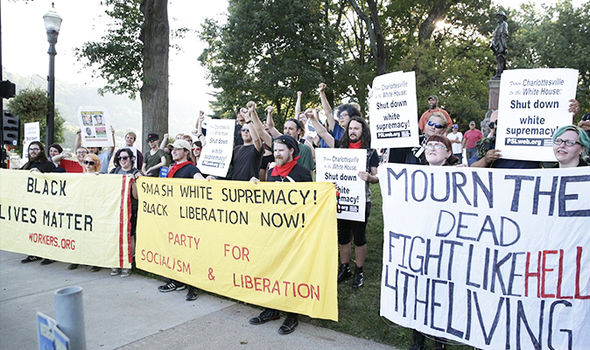
The width and height of the screenshot is (590, 350). In order to click on white bed sheet with black text in this screenshot , I will do `click(497, 234)`.